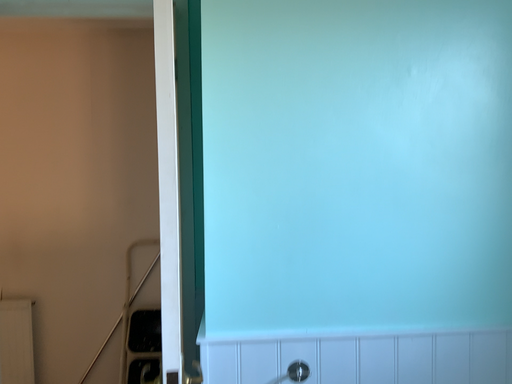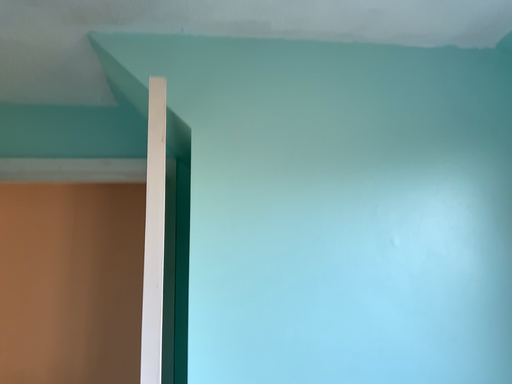
Question: Which way did the camera rotate in the video?

Choices:
 (A) rotated upward
 (B) rotated downward

Answer: (A)